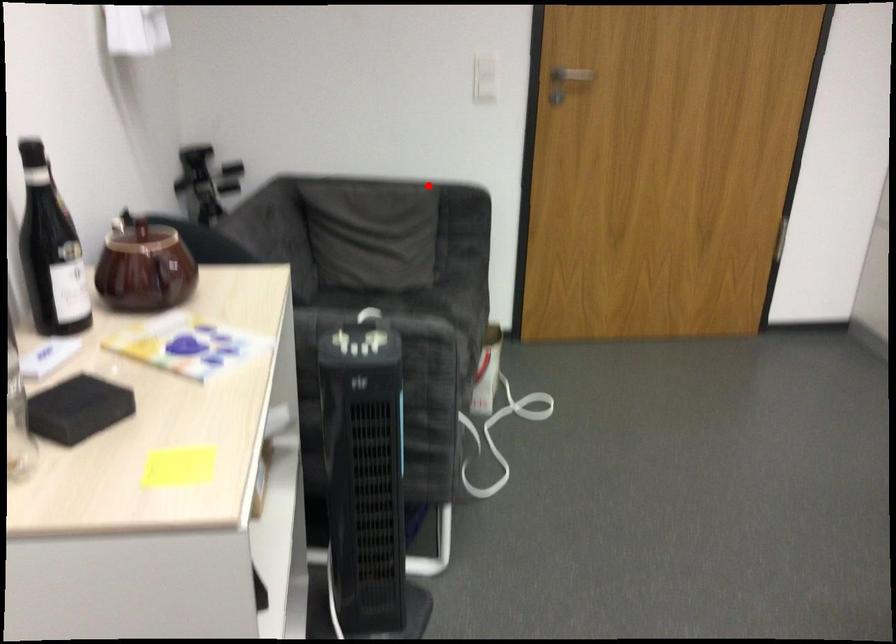
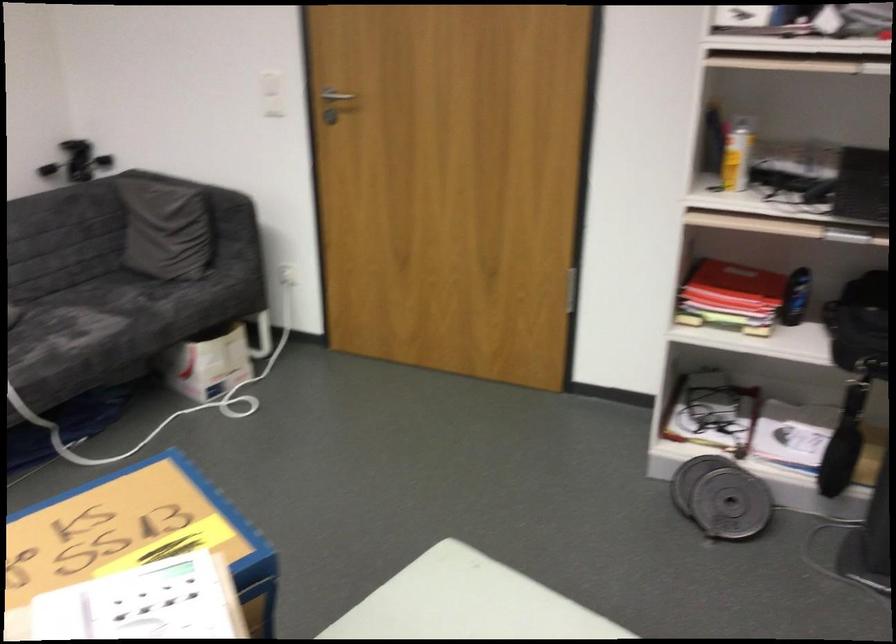
Find the pixel in the second image that matches the highlighted location in the first image.

(209, 194)